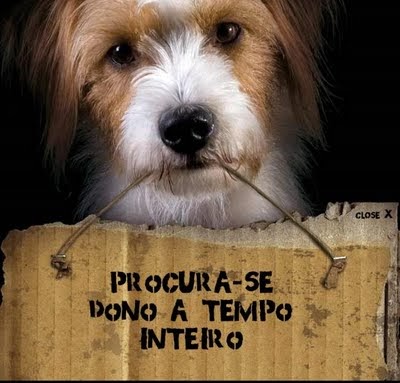
This screenshot has height=383, width=400. What are the coordinates of `wall` in the screenshot? It's located at (317, 287).